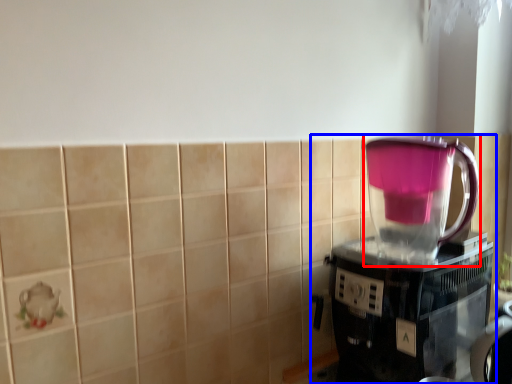
Question: Which object appears farthest to the camera in this image, blender (highlighted by a red box) or coffee maker (highlighted by a blue box)?

Choices:
 (A) blender
 (B) coffee maker

Answer: (A)